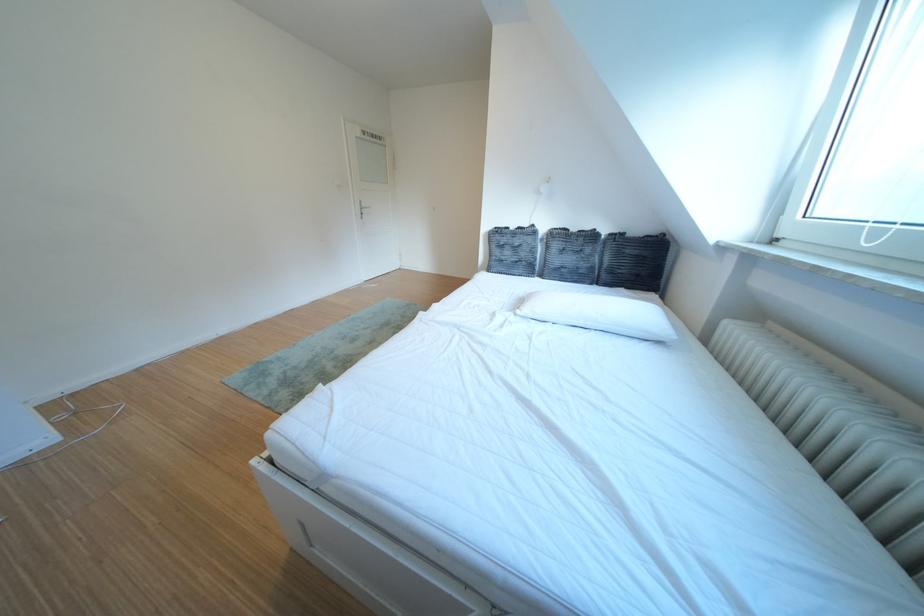
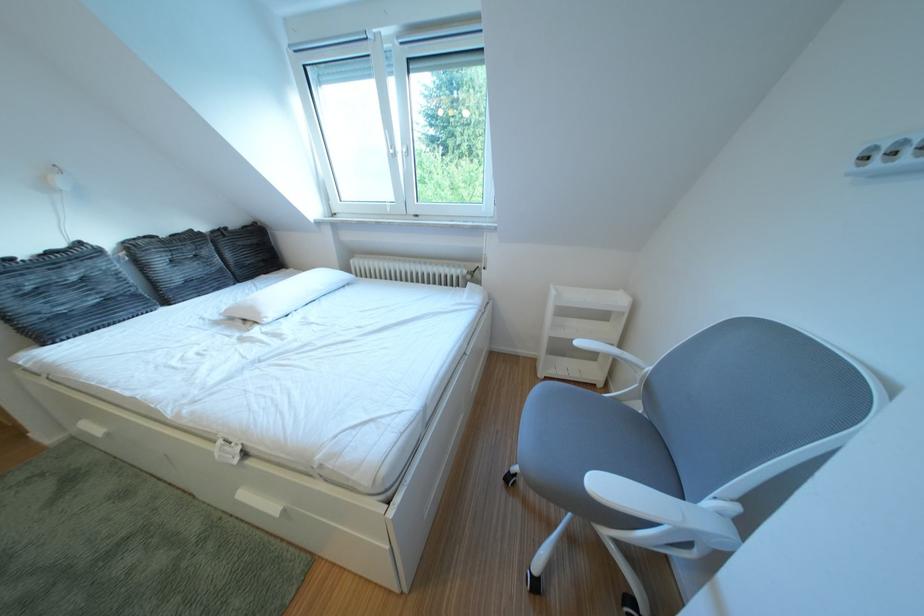
In the second image, find the point that corresponds to point 546,232 in the first image.

(93, 249)